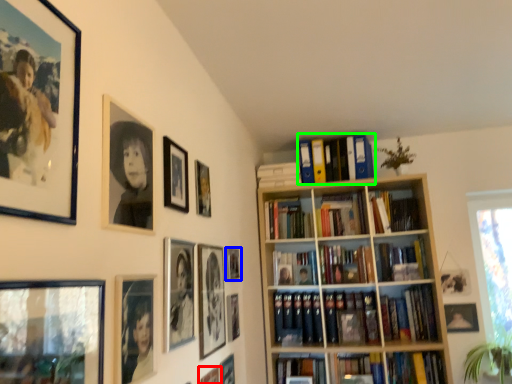
Question: Based on their relative distances, which object is nearer to picture frame (highlighted by a red box)? Choose from picture frame (highlighted by a blue box) and book (highlighted by a green box).

Choices:
 (A) picture frame
 (B) book

Answer: (A)